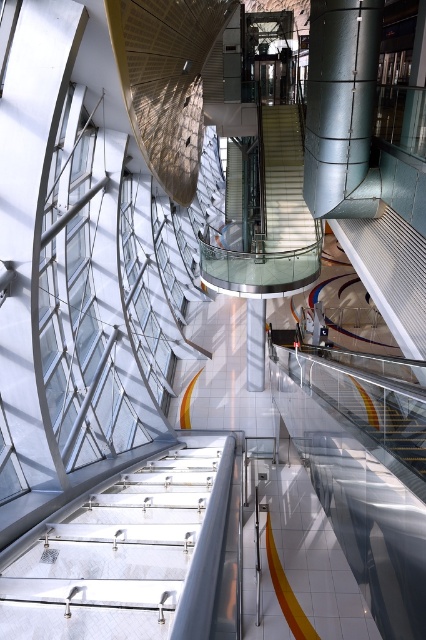
The height and width of the screenshot is (640, 426). What do you see at coordinates (284, 182) in the screenshot? I see `white glossy stairs at center` at bounding box center [284, 182].

This screenshot has height=640, width=426. Identify the location of white glossy stairs at center. (284, 182).

Does metallic silver stairs at center appear under white glossy stairs at center?

Indeed, metallic silver stairs at center is positioned under white glossy stairs at center.

Can you confirm if metallic silver stairs at center is shorter than white glossy stairs at center?

Indeed, metallic silver stairs at center has a lesser height compared to white glossy stairs at center.

Is point (226, 474) behind point (276, 173)?

No, it is not.

You are a GUI agent. You are given a task and a screenshot of the screen. Output one action in this format:
    pyautogui.click(x=<x>, y=<y>)
    Task: Click on the metallic silver stairs at center
    The height and width of the screenshot is (640, 426).
    Given the screenshot: What is the action you would take?
    pyautogui.click(x=127, y=556)

Is metallic silver pillar at upper center shorter than white glossy pillar at center?

Incorrect, metallic silver pillar at upper center's height does not fall short of white glossy pillar at center's.

The width and height of the screenshot is (426, 640). I want to click on metallic silver pillar at upper center, so click(339, 99).